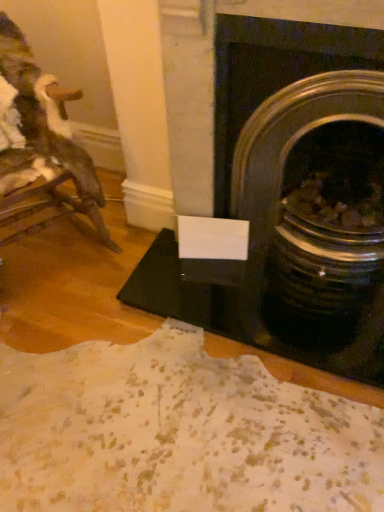
Question: From a real-world perspective, is black glossy fireplace at center right below wooden rocking chair at left?

Choices:
 (A) yes
 (B) no

Answer: (B)

Question: From the image's perspective, is black glossy fireplace at center right above wooden rocking chair at left?

Choices:
 (A) yes
 (B) no

Answer: (B)

Question: Is black glossy fireplace at center right aimed at wooden rocking chair at left?

Choices:
 (A) no
 (B) yes

Answer: (A)

Question: From the image's perspective, is black glossy fireplace at center right beneath wooden rocking chair at left?

Choices:
 (A) no
 (B) yes

Answer: (B)

Question: Is wooden rocking chair at left completely or partially inside black glossy fireplace at center right?

Choices:
 (A) no
 (B) yes

Answer: (A)

Question: Does black glossy fireplace at center right touch wooden rocking chair at left?

Choices:
 (A) no
 (B) yes

Answer: (A)

Question: Is wooden rocking chair at left facing towards black glossy fireplace at center right?

Choices:
 (A) no
 (B) yes

Answer: (A)

Question: From the image's perspective, is wooden rocking chair at left located beneath black glossy fireplace at center right?

Choices:
 (A) no
 (B) yes

Answer: (A)

Question: Are wooden rocking chair at left and black glossy fireplace at center right beside each other?

Choices:
 (A) yes
 (B) no

Answer: (B)

Question: Is wooden rocking chair at left not close to black glossy fireplace at center right?

Choices:
 (A) yes
 (B) no

Answer: (B)

Question: Is wooden rocking chair at left positioned before black glossy fireplace at center right?

Choices:
 (A) yes
 (B) no

Answer: (A)

Question: From a real-world perspective, is wooden rocking chair at left below black glossy fireplace at center right?

Choices:
 (A) no
 (B) yes

Answer: (B)

Question: From a real-world perspective, is wooden rocking chair at left positioned above or below black glossy fireplace at center right?

Choices:
 (A) above
 (B) below

Answer: (B)